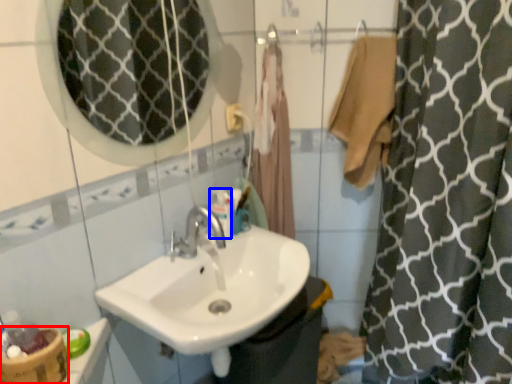
Question: Which point is further to the camera, basket (highlighted by a red box) or mouthwash (highlighted by a blue box)?

Choices:
 (A) basket
 (B) mouthwash

Answer: (B)